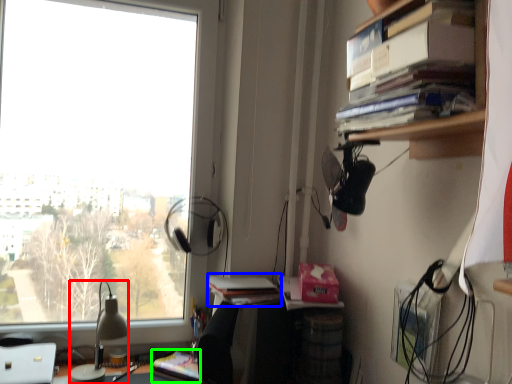
Question: Which object is positioned farthest from lamp (highlighted by a red box)? Select from book (highlighted by a blue box) and paperback book (highlighted by a green box).

Choices:
 (A) book
 (B) paperback book

Answer: (A)